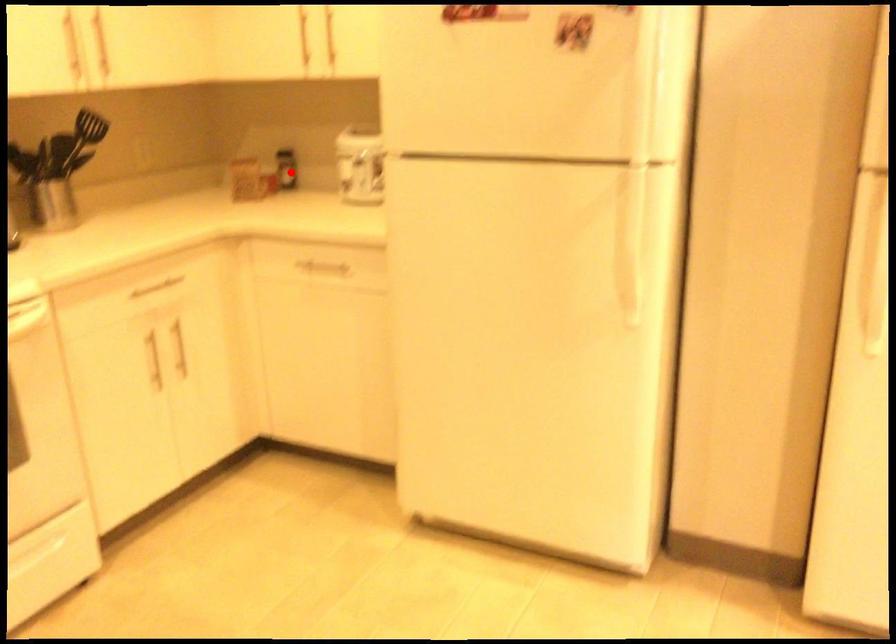
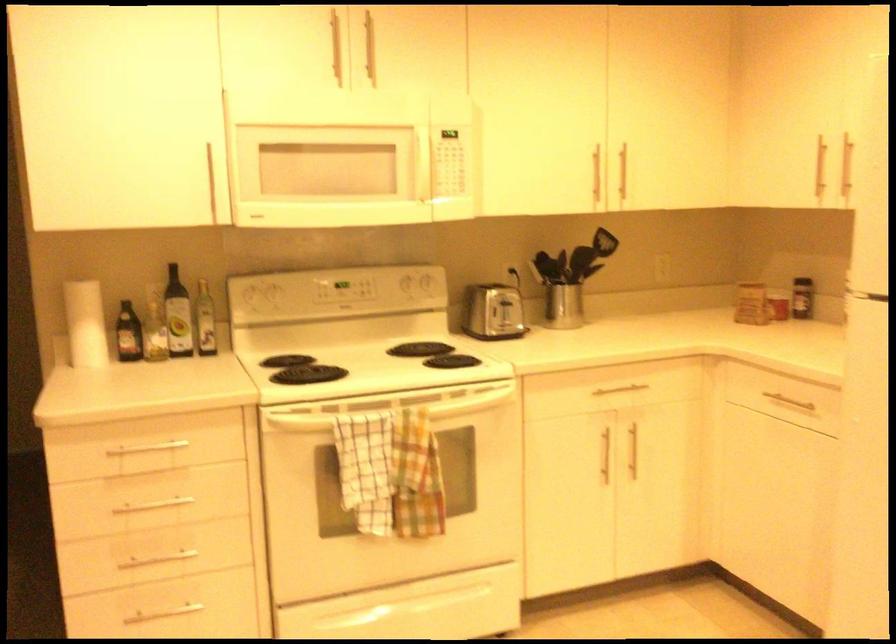
Locate, in the second image, the point that corresponds to the highlighted location in the first image.

(802, 298)